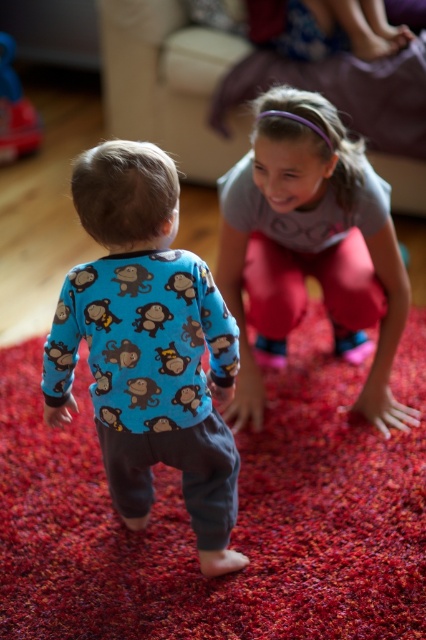
Question: Among these points, which one is farthest from the camera?

Choices:
 (A) (221, 449)
 (B) (351, 326)

Answer: (B)

Question: Estimate the real-world distances between objects in this image. Which object is closer to the blue printed pajamas at center?

Choices:
 (A) rubber duck at left
 (B) matte gray shirt at center

Answer: (B)

Question: Does matte gray shirt at center have a greater width compared to rubber duck at left?

Choices:
 (A) yes
 (B) no

Answer: (A)

Question: Can you confirm if blue printed pajamas at center is positioned to the right of rubber duck at left?

Choices:
 (A) no
 (B) yes

Answer: (B)

Question: Which point appears farthest from the camera in this image?

Choices:
 (A) (40, 132)
 (B) (233, 449)

Answer: (A)

Question: Is blue printed pajamas at center thinner than matte gray shirt at center?

Choices:
 (A) yes
 (B) no

Answer: (A)